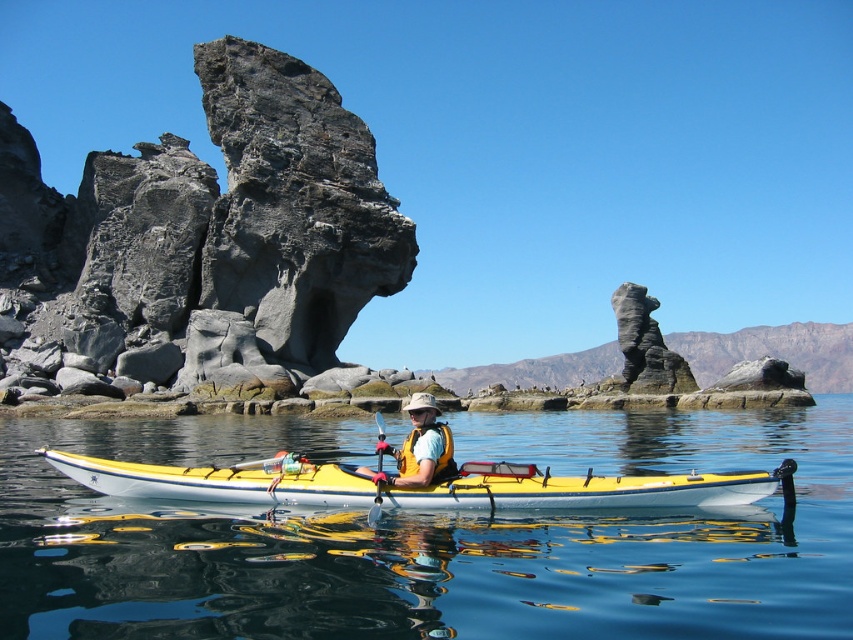
Question: Which object is closer to the camera taking this photo?

Choices:
 (A) transparent blue water at center
 (B) yellow life vest at center
 (C) dark gray stone rock formation at upper left

Answer: (A)

Question: Which object is the farthest from the red plastic paddle at center?

Choices:
 (A) yellow life vest at center
 (B) yellow matte kayak at center
 (C) dark gray stone rock formation at upper left

Answer: (C)

Question: Is dark gray stone rock formation at upper left to the right of yellow matte kayak at center from the viewer's perspective?

Choices:
 (A) no
 (B) yes

Answer: (A)

Question: Does yellow life vest at center have a smaller size compared to red plastic paddle at center?

Choices:
 (A) no
 (B) yes

Answer: (A)

Question: Which point is closer to the camera?

Choices:
 (A) red plastic paddle at center
 (B) dark gray stone rock formation at upper left
 (C) transparent blue water at center

Answer: (C)

Question: From the image, what is the correct spatial relationship of transparent blue water at center in relation to yellow life vest at center?

Choices:
 (A) below
 (B) above

Answer: (A)